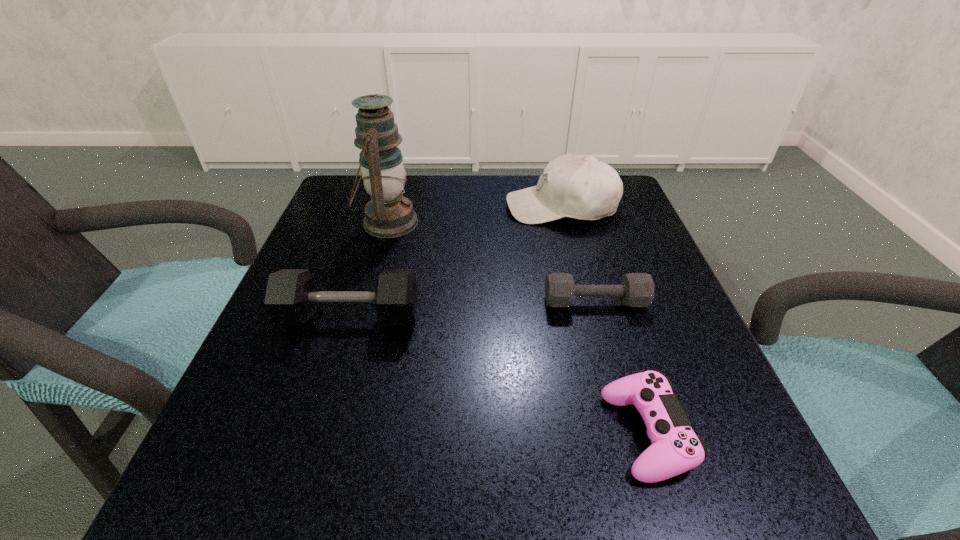
At what (x,y) coordinates should I click in order to perform the action: click on control at the right edge. Please return your answer as a coordinate pair (x, y). This screenshot has height=540, width=960. Looking at the image, I should click on (675, 449).

The width and height of the screenshot is (960, 540). Find the location of `object present at the far left corner`. object present at the far left corner is located at coordinates (389, 214).

At what (x,y) coordinates should I click in order to perform the action: click on object that is at the far right corner. Please return your answer as a coordinate pair (x, y). Looking at the image, I should click on (581, 187).

This screenshot has width=960, height=540. Find the location of `object present at the near right corner`. object present at the near right corner is located at coordinates (675, 449).

Image resolution: width=960 pixels, height=540 pixels. What are the coordinates of `free space at the far edge` in the screenshot? It's located at (444, 225).

At what (x,y) coordinates should I click in order to perform the action: click on free space at the near edge of the desktop. Please return your answer as a coordinate pair (x, y). The width and height of the screenshot is (960, 540). Looking at the image, I should click on (499, 517).

Identify the location of vacant space at the left edge. The width and height of the screenshot is (960, 540). (351, 244).

Locate an element on the screen. vacant space at the far left corner of the desktop is located at coordinates (360, 193).

Identify the location of vacant point at the near right corner. (690, 488).

Locate an element on the screen. The height and width of the screenshot is (540, 960). free spot between the shorter dumbbell and the oil lamp is located at coordinates (492, 262).